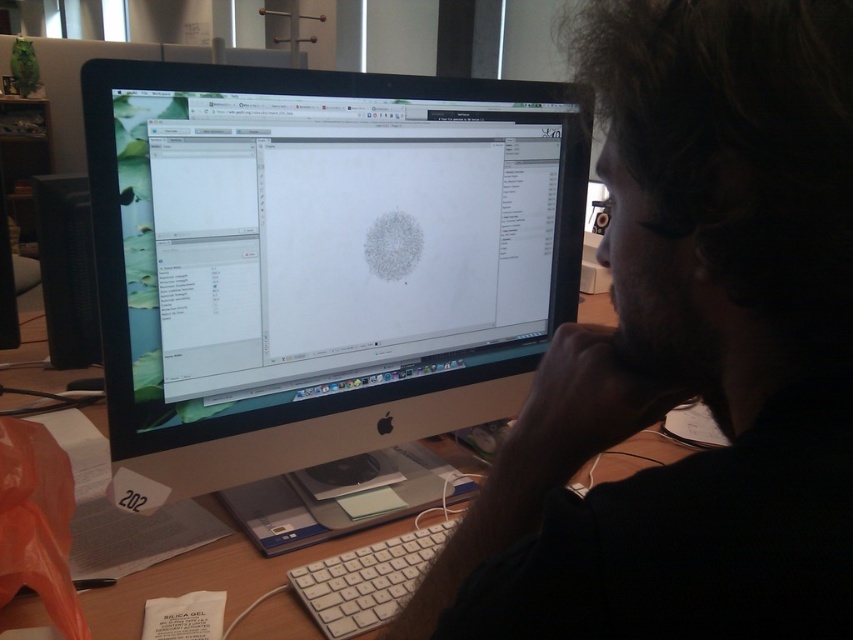
You are a researcher trying to locate your black glossy monitor at center in the image. The coordinates given are point (320, 260). Can you confirm if this point is the correct location for the black glossy monitor at center?

Yes, the point (320, 260) corresponds to the black glossy monitor at center, so this is the correct location.

What are the coordinates of the black glossy monitor at center in the image?

The black glossy monitor at center is located at coordinates point (320,260).

You are organizing the desk items. The black matte monitor at center and the white plastic keyboard at lower center are both on the desk. Which object is taller?

The black matte monitor at center is taller than the white plastic keyboard at lower center.